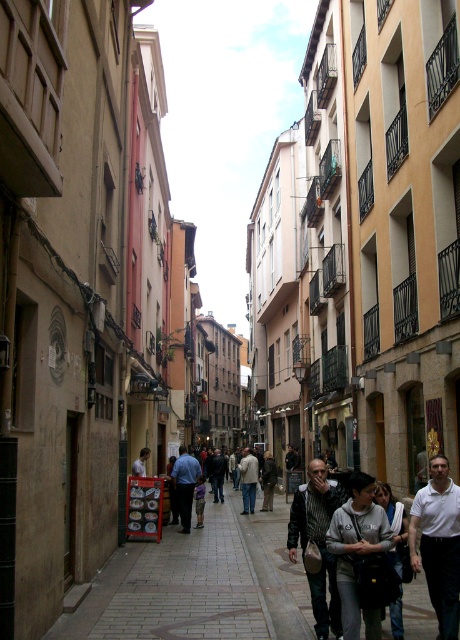
Does white matte shirt at lower right have a smaller size compared to light blue shirt at center?

Actually, white matte shirt at lower right might be larger than light blue shirt at center.

Can you confirm if white matte shirt at lower right is shorter than light blue shirt at center?

Incorrect, white matte shirt at lower right's height does not fall short of light blue shirt at center's.

Identify the location of white matte shirt at lower right. (438, 544).

Find the location of a particular element. white matte shirt at lower right is located at coordinates tap(438, 544).

Can you confirm if light gray jacket at center is taller than light blue shirt at center?

Indeed, light gray jacket at center has a greater height compared to light blue shirt at center.

Which is in front, point (241, 465) or point (147, 452)?

Point (147, 452)

Where is `light gray jacket at center`? light gray jacket at center is located at coordinates (247, 480).

Can you confirm if white matte shirt at lower right is positioned to the left of dark brown leather jacket at center?

No, white matte shirt at lower right is not to the left of dark brown leather jacket at center.

Who is taller, white matte shirt at lower right or dark brown leather jacket at center?

With more height is white matte shirt at lower right.

Where is `white matte shirt at lower right`? The image size is (460, 640). white matte shirt at lower right is located at coordinates (438, 544).

The height and width of the screenshot is (640, 460). I want to click on white matte shirt at lower right, so click(438, 544).